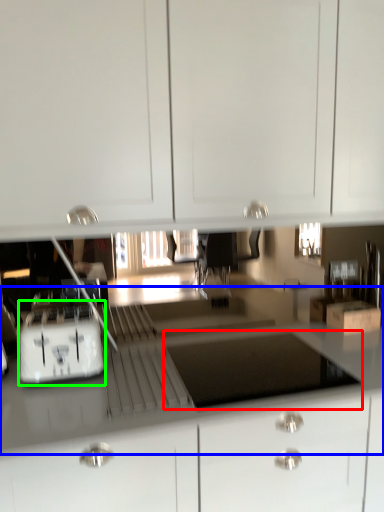
Question: Based on their relative distances, which object is farther from appliance (highlighted by a red box)? Choose from counter top (highlighted by a blue box) and home appliance (highlighted by a green box).

Choices:
 (A) counter top
 (B) home appliance

Answer: (B)